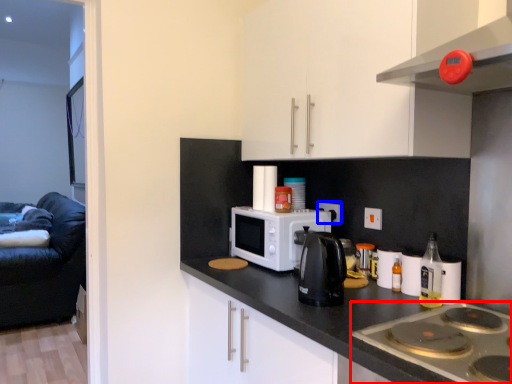
Question: Which object appears farthest to the camera in this image, gas stove (highlighted by a red box) or electric outlet (highlighted by a blue box)?

Choices:
 (A) gas stove
 (B) electric outlet

Answer: (B)